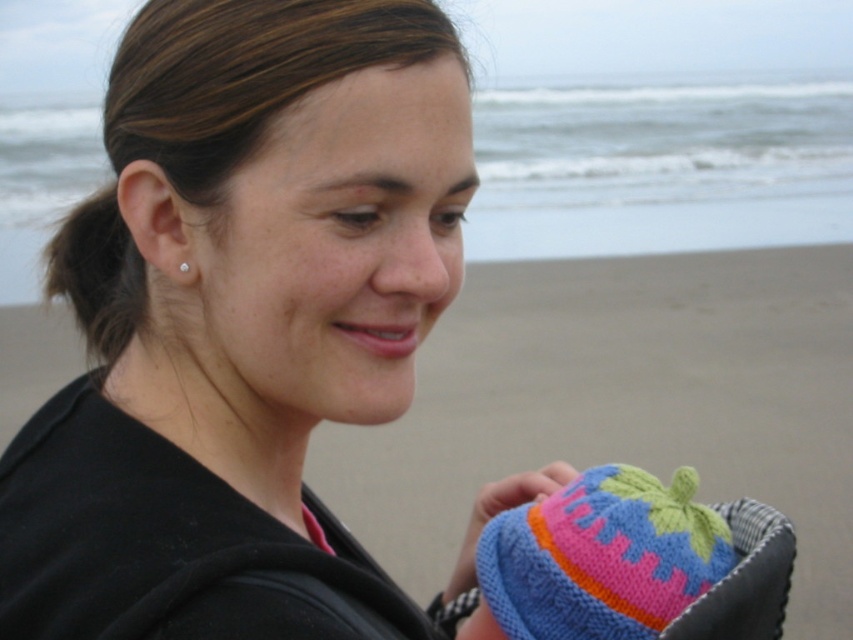
You are a tailor trying to decide which knitted item to use for a client who needs a wider hat. Looking at the image, which one between the knitted wool hat at lower right and the knitted fabric baby hat at lower right is wider?

The knitted wool hat at lower right might be wider than knitted fabric baby hat at lower right, so the knitted wool hat at lower right is the better choice for the client needing a wider hat.

You are a photographer taking a picture of the knitted wool hat at lower right and the knitted fabric baby hat at lower right. Which one should you focus on first if you want to capture both in sharp focus?

The knitted wool hat at lower right should be focused on first because it is above the knitted fabric baby hat at lower right, so adjusting focus starting from the higher one ensures both are in sharp focus.